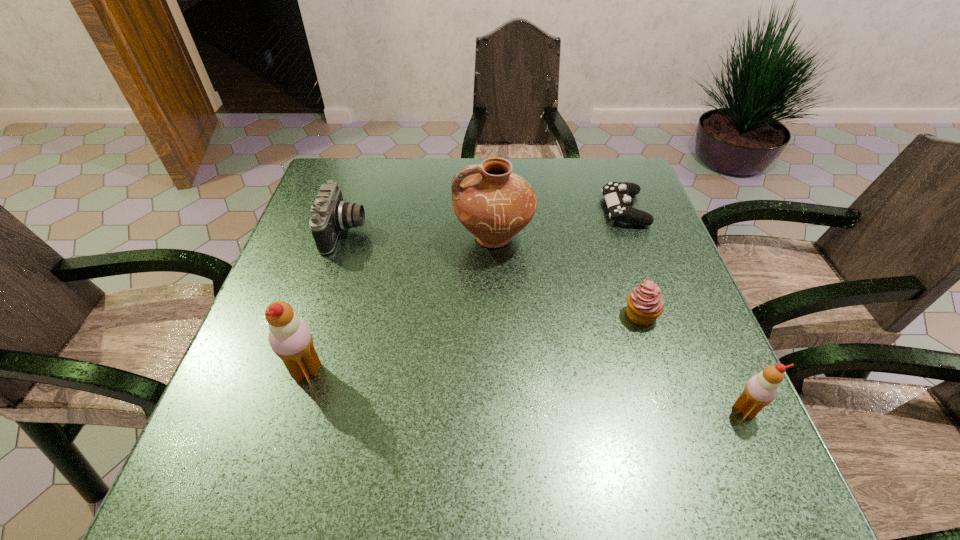
Find the location of `vacant space located 0.340m on the side of the third object from left to right with the handle`. vacant space located 0.340m on the side of the third object from left to right with the handle is located at coordinates pos(318,238).

Locate an element on the screen. The image size is (960, 540). vacant position located 0.050m on the side of the third object from left to right with the handle is located at coordinates (434, 238).

I want to click on vacant space located on the side of the third object from left to right with the handle, so tap(342, 238).

You are a GUI agent. You are given a task and a screenshot of the screen. Output one action in this format:
    pyautogui.click(x=<x>, y=<y>)
    Task: Click on the free space located 0.070m on the surface of the shortest object
    The image size is (960, 540).
    Given the screenshot: What is the action you would take?
    pyautogui.click(x=578, y=210)

Find the location of a particular element. This screenshot has height=540, width=960. blank space located 0.390m on the surface of the shortest object is located at coordinates (458, 210).

This screenshot has height=540, width=960. Find the location of `free space located 0.180m on the surface of the shortest object`. free space located 0.180m on the surface of the shortest object is located at coordinates (537, 210).

I want to click on blank area located 0.240m on the front-facing side of the third shortest object, so click(x=460, y=232).

The image size is (960, 540). I want to click on vacant space located on the back of the third nearest object, so click(x=604, y=202).

Find the location of a particular element. The image size is (960, 540). object that is positioned at the far edge is located at coordinates (617, 195).

Image resolution: width=960 pixels, height=540 pixels. Find the location of `icecream at the left edge`. icecream at the left edge is located at coordinates (290, 338).